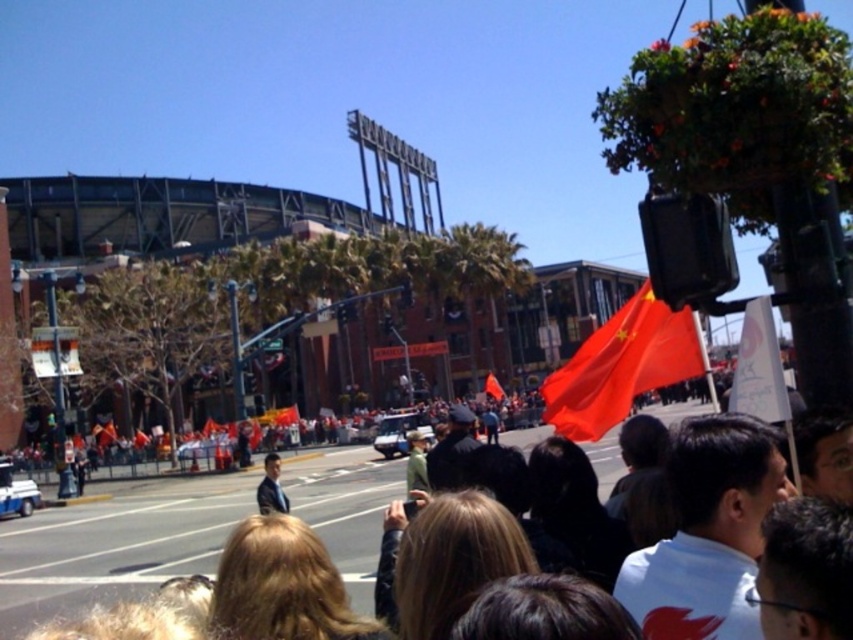
You are a photographer standing at the edge of the crowd. You want to take a photo that includes both the white cotton shirt at center and the red matte flag at center. Given that your camera has a maximum zoom range of 50 meters, will you be able to capture both subjects in a single frame without moving your position?

The distance between the white cotton shirt at center and the red matte flag at center is 43.30 meters. Since your camera can zoom up to 50 meters, you can capture both subjects in a single frame without moving.

You are a photographer trying to capture the red matte flag at center without any obstructions. Based on the scene, is the white cotton shirt at center blocking your view of the flag?

The white cotton shirt at center is below the red matte flag at center, so the shirt is not blocking the view of the flag as it is positioned lower down.